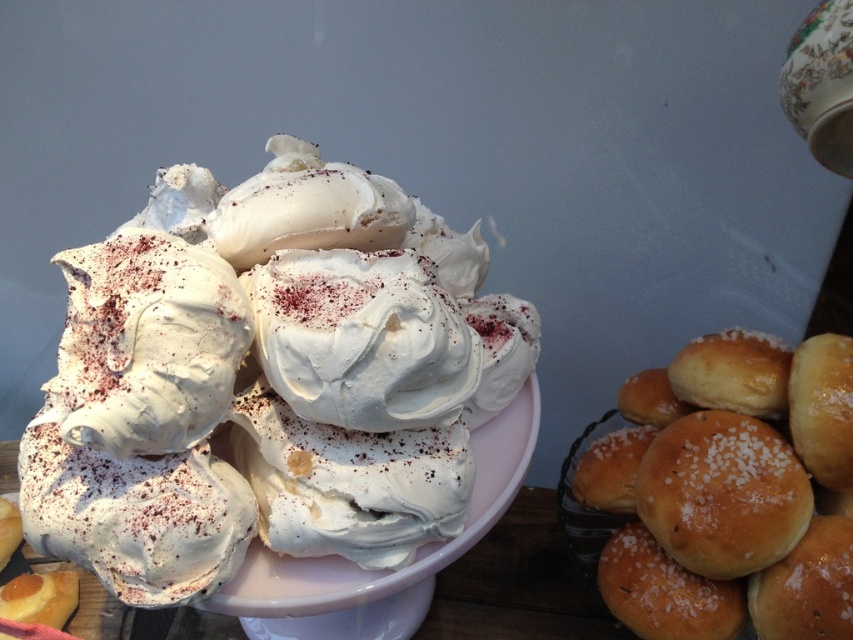
Question: Observing the image, what is the correct spatial positioning of white fluffy meringue at center in reference to slightly golden bread at right?

Choices:
 (A) right
 (B) left

Answer: (B)

Question: Is white fluffy meringue at center to the left of slightly golden bread at right from the viewer's perspective?

Choices:
 (A) yes
 (B) no

Answer: (A)

Question: Which point is closer to the camera taking this photo?

Choices:
 (A) (479, 236)
 (B) (759, 532)

Answer: (B)

Question: Does white fluffy meringue at center come behind slightly golden bread at right?

Choices:
 (A) no
 (B) yes

Answer: (A)